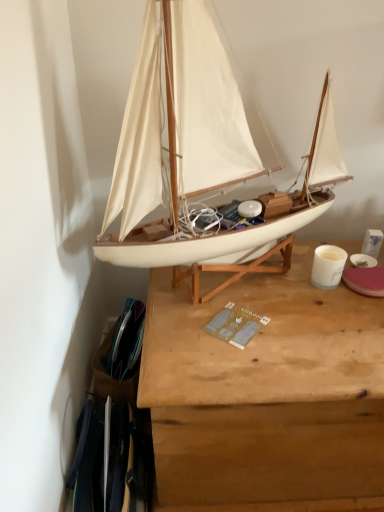
Question: Considering their positions, is white matte sailboat at center located in front of or behind wooden desk at center?

Choices:
 (A) behind
 (B) front

Answer: (B)

Question: Looking at their shapes, would you say white matte sailboat at center is wider or thinner than wooden desk at center?

Choices:
 (A) wide
 (B) thin

Answer: (B)

Question: Looking at the image, does white matte sailboat at center seem bigger or smaller compared to wooden desk at center?

Choices:
 (A) small
 (B) big

Answer: (A)

Question: Is wooden desk at center taller or shorter than white matte sailboat at center?

Choices:
 (A) short
 (B) tall

Answer: (A)

Question: Considering their positions, is wooden desk at center located in front of or behind white matte sailboat at center?

Choices:
 (A) behind
 (B) front

Answer: (A)

Question: Is wooden desk at center spatially inside white matte sailboat at center, or outside of it?

Choices:
 (A) outside
 (B) inside

Answer: (A)

Question: In terms of size, does wooden desk at center appear bigger or smaller than white matte sailboat at center?

Choices:
 (A) small
 (B) big

Answer: (B)